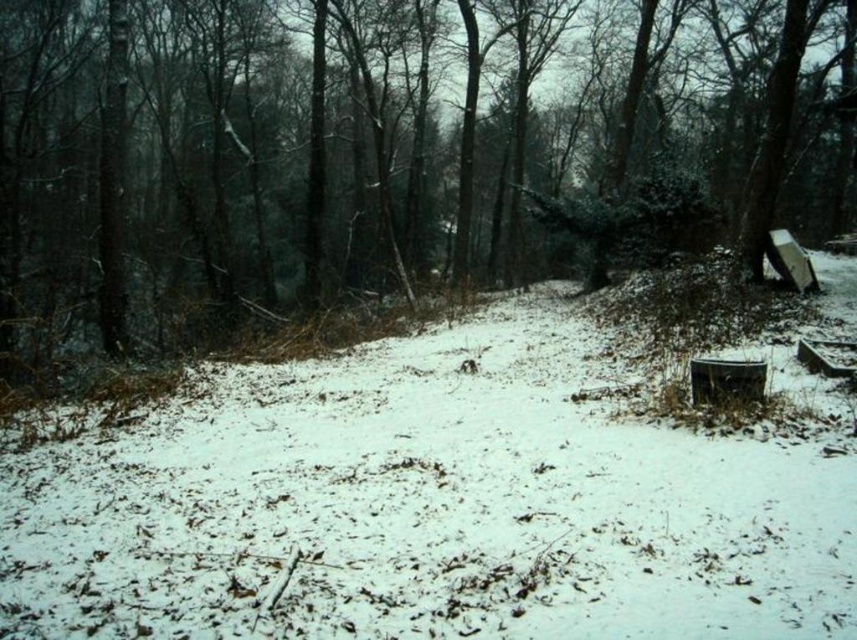
Is point (133, 278) positioned after point (22, 536)?

That is True.

Is snow-covered tree at center to the left of white matte snow at center from the viewer's perspective?

Incorrect, snow-covered tree at center is not on the left side of white matte snow at center.

Measure the distance between snow-covered tree at center and camera.

snow-covered tree at center is 10.82 meters from camera.

At what (x,y) coordinates should I click in order to perform the action: click on snow-covered tree at center. Please return your answer as a coordinate pair (x, y). Looking at the image, I should click on (388, 154).